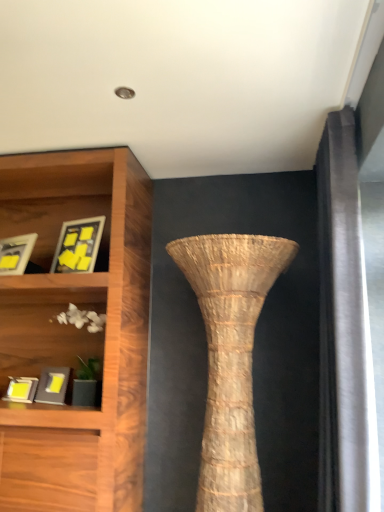
Identify the location of matte yellow picture frame at left, which is the 3th picture frame from bottom to top. This screenshot has height=512, width=384. (16, 253).

Describe the element at coordinates (78, 245) in the screenshot. This screenshot has width=384, height=512. I see `matte wooden picture frame at upper left, the first picture frame when ordered from top to bottom` at that location.

Describe the element at coordinates (230, 356) in the screenshot. I see `natural woven vase at center` at that location.

I want to click on matte black picture frame at lower left, the 4th picture frame when ordered from top to bottom, so click(21, 389).

Which of these two, matte wooden picture frame at upper left, the first picture frame when ordered from top to bottom, or natural woven vase at center, is smaller?

matte wooden picture frame at upper left, the first picture frame when ordered from top to bottom, is smaller.

Is matte wooden picture frame at upper left, the 4th picture frame when ordered from bottom to top, taller than natural woven vase at center?

No, matte wooden picture frame at upper left, the 4th picture frame when ordered from bottom to top, is not taller than natural woven vase at center.

From the image's perspective, which one is positioned lower, matte wooden picture frame at upper left, the first picture frame when ordered from top to bottom, or natural woven vase at center?

natural woven vase at center.

Considering the positions of objects matte wooden picture frame at upper left, the first picture frame when ordered from top to bottom, and natural woven vase at center in the image provided, who is in front, matte wooden picture frame at upper left, the first picture frame when ordered from top to bottom, or natural woven vase at center?

natural woven vase at center.

In the scene shown: Is white matte shells at lower left at the left side of matte wooden picture frame at upper left, the first picture frame when ordered from top to bottom?

Incorrect, white matte shells at lower left is not on the left side of matte wooden picture frame at upper left, the first picture frame when ordered from top to bottom.

Find the location of a particular element. The width and height of the screenshot is (384, 512). shelf below the matte wooden picture frame at upper left, the 4th picture frame when ordered from bottom to top (from the image's perspective) is located at coordinates (45, 329).

Considering the positions of point (73, 335) and point (68, 241), is point (73, 335) closer or farther from the camera than point (68, 241)?

Clearly, point (73, 335) is more distant from the camera than point (68, 241).

From a real-world perspective, which is physically above, white matte shells at lower left or matte wooden picture frame at upper left, the 4th picture frame when ordered from bottom to top?

matte wooden picture frame at upper left, the 4th picture frame when ordered from bottom to top, from a real-world perspective.

From the image's perspective, would you say white matte shells at lower left is shown under matte yellow picture frame at left, which is the 3th picture frame from bottom to top?

Correct, white matte shells at lower left appears lower than matte yellow picture frame at left, which is the 3th picture frame from bottom to top, in the image.

Considering the relative sizes of white matte shells at lower left and matte yellow picture frame at left, positioned as the 2th picture frame in top-to-bottom order, in the image provided, is white matte shells at lower left wider than matte yellow picture frame at left, positioned as the 2th picture frame in top-to-bottom order,?

Yes.

Considering the sizes of white matte shells at lower left and matte yellow picture frame at left, positioned as the 2th picture frame in top-to-bottom order, in the image, is white matte shells at lower left taller or shorter than matte yellow picture frame at left, positioned as the 2th picture frame in top-to-bottom order,?

Considering their sizes, white matte shells at lower left has more height than matte yellow picture frame at left, positioned as the 2th picture frame in top-to-bottom order.

Are white matte shells at lower left and matte yellow picture frame at left, which is the 3th picture frame from bottom to top, located far from each other?

Actually, white matte shells at lower left and matte yellow picture frame at left, which is the 3th picture frame from bottom to top, are a little close together.

From a real-world perspective, is matte black picture frame at lower left, placed as the second picture frame when sorted from bottom to top, positioned above or below matte black picture frame at lower left, the 1th picture frame from the bottom?

matte black picture frame at lower left, placed as the second picture frame when sorted from bottom to top, is above matte black picture frame at lower left, the 1th picture frame from the bottom.

From the image's perspective, which object appears higher, matte black picture frame at lower left, placed as the second picture frame when sorted from bottom to top, or matte black picture frame at lower left, the 1th picture frame from the bottom?

matte black picture frame at lower left, placed as the second picture frame when sorted from bottom to top.

Considering the sizes of objects matte black picture frame at lower left, the third picture frame viewed from the top, and matte black picture frame at lower left, the 1th picture frame from the bottom, in the image provided, who is thinner, matte black picture frame at lower left, the third picture frame viewed from the top, or matte black picture frame at lower left, the 1th picture frame from the bottom,?

With smaller width is matte black picture frame at lower left, the 1th picture frame from the bottom.

Which is more to the left, matte black picture frame at lower left, the third picture frame viewed from the top, or matte black picture frame at lower left, the 4th picture frame when ordered from top to bottom?

From the viewer's perspective, matte black picture frame at lower left, the 4th picture frame when ordered from top to bottom, appears more on the left side.

Looking at their sizes, would you say matte wooden picture frame at upper left, the 4th picture frame when ordered from bottom to top, is wider or thinner than matte black picture frame at lower left, the 4th picture frame when ordered from top to bottom?

Clearly, matte wooden picture frame at upper left, the 4th picture frame when ordered from bottom to top, has less width compared to matte black picture frame at lower left, the 4th picture frame when ordered from top to bottom.

Which is less distant, (89, 223) or (37, 380)?

The point (37, 380) is in front.

Consider the image. From the image's perspective, between matte wooden picture frame at upper left, the 4th picture frame when ordered from bottom to top, and matte black picture frame at lower left, the 1th picture frame from the bottom, which one is located above?

matte wooden picture frame at upper left, the 4th picture frame when ordered from bottom to top, appears higher in the image.

In the scene shown: Which object is thinner, matte black picture frame at lower left, the third picture frame viewed from the top, or natural woven vase at center?

Thinner between the two is matte black picture frame at lower left, the third picture frame viewed from the top.

Does point (62, 371) appear closer or farther from the camera than point (225, 392)?

Point (62, 371) is farther from the camera than point (225, 392).

Is matte black picture frame at lower left, the third picture frame viewed from the top, not near natural woven vase at center?

matte black picture frame at lower left, the third picture frame viewed from the top, is far away from natural woven vase at center.

From the image's perspective, is matte wooden picture frame at upper left, the 4th picture frame when ordered from bottom to top, located beneath white matte shells at lower left?

Incorrect, from the image's perspective, matte wooden picture frame at upper left, the 4th picture frame when ordered from bottom to top, is higher than white matte shells at lower left.

Who is taller, matte wooden picture frame at upper left, the first picture frame when ordered from top to bottom, or white matte shells at lower left?

white matte shells at lower left.

Find the location of `shelf below the matte wooden picture frame at upper left, the 4th picture frame when ordered from bottom to top (from the image's perspective)`. shelf below the matte wooden picture frame at upper left, the 4th picture frame when ordered from bottom to top (from the image's perspective) is located at coordinates (45, 329).

From the picture: Is the depth of matte wooden picture frame at upper left, the first picture frame when ordered from top to bottom, greater than that of white matte shells at lower left?

Yes, matte wooden picture frame at upper left, the first picture frame when ordered from top to bottom, is further from the camera.

There is a natural woven vase at center. Where is `the 2nd picture frame above it (from the image's perspective)`? This screenshot has height=512, width=384. the 2nd picture frame above it (from the image's perspective) is located at coordinates (78, 245).

Image resolution: width=384 pixels, height=512 pixels. I want to click on shelf that is on the right side of matte wooden picture frame at upper left, the first picture frame when ordered from top to bottom, so click(45, 329).

Considering their positions, is matte black picture frame at lower left, the third picture frame viewed from the top, positioned closer to natural woven vase at center than matte wooden picture frame at upper left, the 4th picture frame when ordered from bottom to top?

Among the two, matte wooden picture frame at upper left, the 4th picture frame when ordered from bottom to top, is located nearer to natural woven vase at center.

Considering their positions, is matte black picture frame at lower left, the 4th picture frame when ordered from top to bottom, positioned further to white matte shells at lower left than matte wooden picture frame at upper left, the first picture frame when ordered from top to bottom?

matte wooden picture frame at upper left, the first picture frame when ordered from top to bottom, is positioned further to the anchor white matte shells at lower left.

Estimate the real-world distances between objects in this image. Which object is further from matte yellow picture frame at left, which is the 3th picture frame from bottom to top, matte black picture frame at lower left, placed as the second picture frame when sorted from bottom to top, or matte wooden picture frame at upper left, the 4th picture frame when ordered from bottom to top?

The object further to matte yellow picture frame at left, which is the 3th picture frame from bottom to top, is matte black picture frame at lower left, placed as the second picture frame when sorted from bottom to top.

Considering their positions, is matte black picture frame at lower left, placed as the second picture frame when sorted from bottom to top, positioned closer to matte yellow picture frame at left, positioned as the 2th picture frame in top-to-bottom order, than white matte shells at lower left?

Among the two, white matte shells at lower left is located nearer to matte yellow picture frame at left, positioned as the 2th picture frame in top-to-bottom order.

When comparing their distances from matte black picture frame at lower left, placed as the second picture frame when sorted from bottom to top, does natural woven vase at center or matte yellow picture frame at left, positioned as the 2th picture frame in top-to-bottom order, seem further?

natural woven vase at center is further to matte black picture frame at lower left, placed as the second picture frame when sorted from bottom to top.

Based on their spatial positions, is natural woven vase at center or white matte shells at lower left closer to matte yellow picture frame at left, which is the 3th picture frame from bottom to top?

white matte shells at lower left is positioned closer to the anchor matte yellow picture frame at left, which is the 3th picture frame from bottom to top.

When comparing their distances from matte black picture frame at lower left, the 4th picture frame when ordered from top to bottom, does matte wooden picture frame at upper left, the first picture frame when ordered from top to bottom, or matte yellow picture frame at left, positioned as the 2th picture frame in top-to-bottom order, seem further?

Based on the image, matte wooden picture frame at upper left, the first picture frame when ordered from top to bottom, appears to be further to matte black picture frame at lower left, the 4th picture frame when ordered from top to bottom.

Which object lies nearer to the anchor point matte black picture frame at lower left, the 4th picture frame when ordered from top to bottom, white matte shells at lower left or matte black picture frame at lower left, placed as the second picture frame when sorted from bottom to top?

matte black picture frame at lower left, placed as the second picture frame when sorted from bottom to top.

Identify the location of shelf located between matte black picture frame at lower left, the third picture frame viewed from the top, and natural woven vase at center in the left-right direction. This screenshot has height=512, width=384. (45, 329).

Where is `shelf situated between matte black picture frame at lower left, the 4th picture frame when ordered from top to bottom, and natural woven vase at center from left to right`? shelf situated between matte black picture frame at lower left, the 4th picture frame when ordered from top to bottom, and natural woven vase at center from left to right is located at coordinates (45, 329).

Where is `shelf between matte yellow picture frame at left, which is the 3th picture frame from bottom to top, and matte black picture frame at lower left, the third picture frame viewed from the top, in the up-down direction`? shelf between matte yellow picture frame at left, which is the 3th picture frame from bottom to top, and matte black picture frame at lower left, the third picture frame viewed from the top, in the up-down direction is located at coordinates (45, 329).

Find the location of a particular element. The width and height of the screenshot is (384, 512). picture frame situated between matte black picture frame at lower left, placed as the second picture frame when sorted from bottom to top, and natural woven vase at center from left to right is located at coordinates (78, 245).